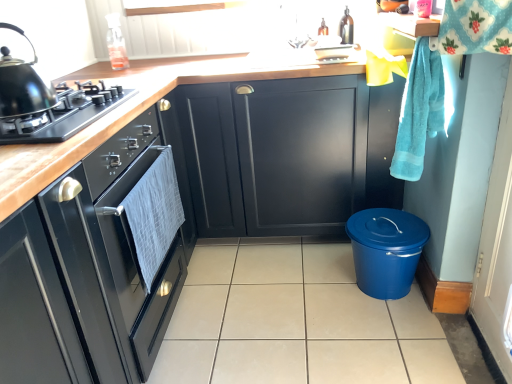
Question: From a real-world perspective, is shiny black kettle at left physically located above or below beige tile at center?

Choices:
 (A) above
 (B) below

Answer: (A)

Question: Is point (22, 79) closer or farther from the camera than point (287, 306)?

Choices:
 (A) closer
 (B) farther

Answer: (A)

Question: Based on their relative distances, which object is farther from the matte black cabinets at center, the third cabinetry positioned from the back?

Choices:
 (A) black matte gas stove at left
 (B) turquoise terry cloth hand towel at right
 (C) beige tile at center
 (D) matte black oven at left, which is the 2th cabinetry in front-to-back order
 (E) matte black cabinet at center, arranged as the 1th cabinetry when viewed from the back

Answer: (B)

Question: Considering the real-world distances, which object is closest to the black matte gas stove at left?

Choices:
 (A) matte black cabinet at center, arranged as the 1th cabinetry when viewed from the back
 (B) matte brown bottle at upper center
 (C) beige tile at center
 (D) turquoise terry cloth hand towel at right
 (E) shiny black kettle at left

Answer: (E)